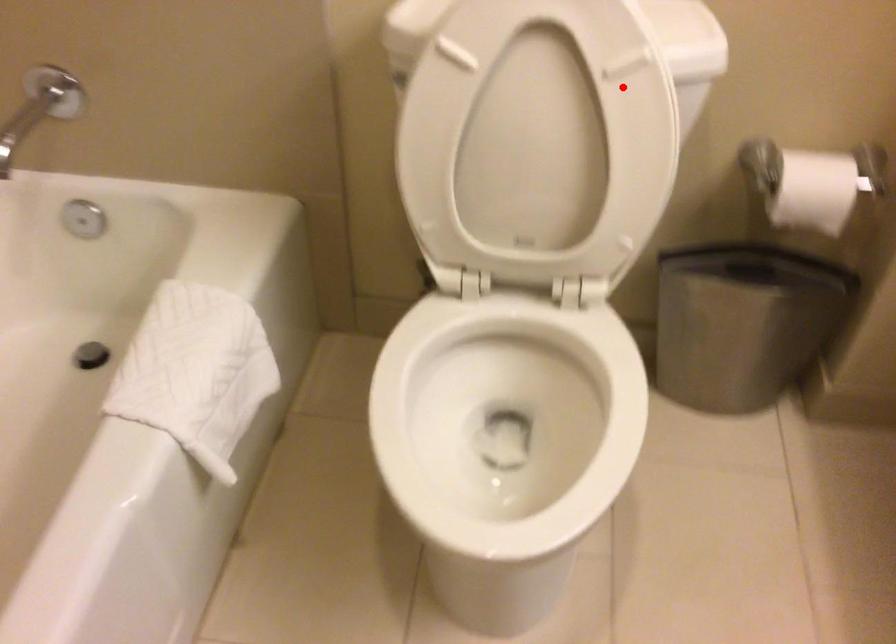
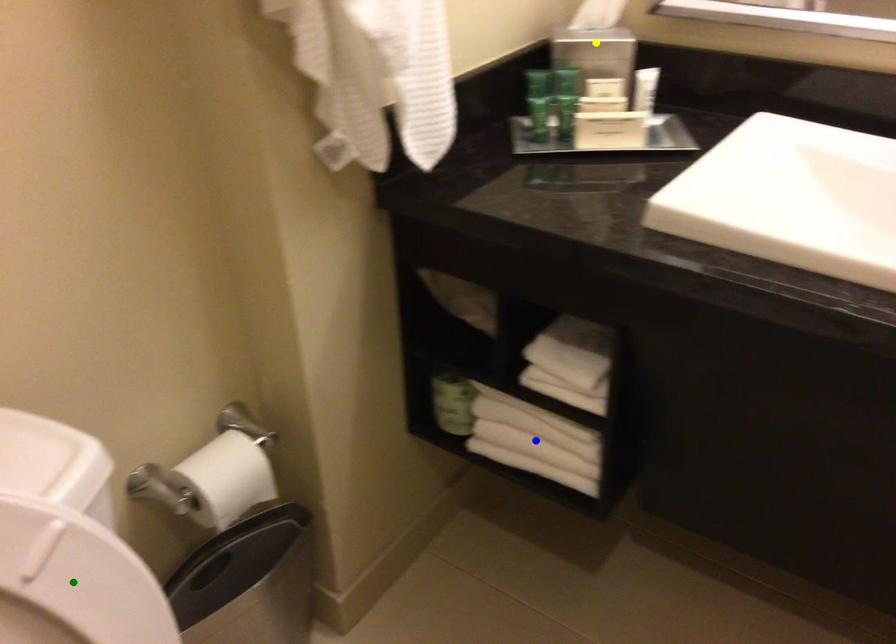
Question: I am providing you with two images of the same scene from different viewpoints. A red point is marked on the first image. You are given multiple points on the second image. Which spot in image 2 lines up with the point in image 1?

Choices:
 (A) yellow point
 (B) green point
 (C) blue point

Answer: (B)